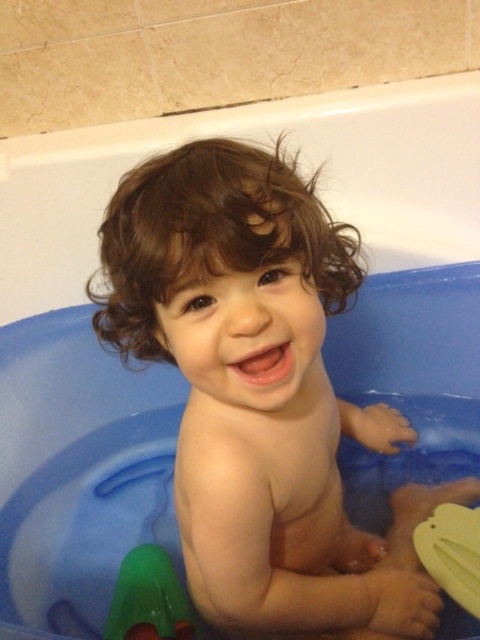
Question: Which point is farther to the camera?

Choices:
 (A) (471, 584)
 (B) (167, 593)
 (C) (196, 140)

Answer: (B)

Question: Among these points, which one is farthest from the camera?

Choices:
 (A) (169, 586)
 (B) (240, 177)

Answer: (A)

Question: Observing the image, what is the correct spatial positioning of smooth skin baby at center in reference to green rubber toy at lower left?

Choices:
 (A) left
 (B) right

Answer: (B)

Question: Among these points, which one is nearest to the camera?

Choices:
 (A) (472, 584)
 (B) (156, 636)
 (C) (240, 348)

Answer: (C)

Question: Where is smooth skin baby at center located in relation to green rubber toy at lower left in the image?

Choices:
 (A) left
 (B) right

Answer: (B)

Question: From the image, what is the correct spatial relationship of smooth skin baby at center in relation to yellow rubber duck at lower right?

Choices:
 (A) left
 (B) right

Answer: (A)